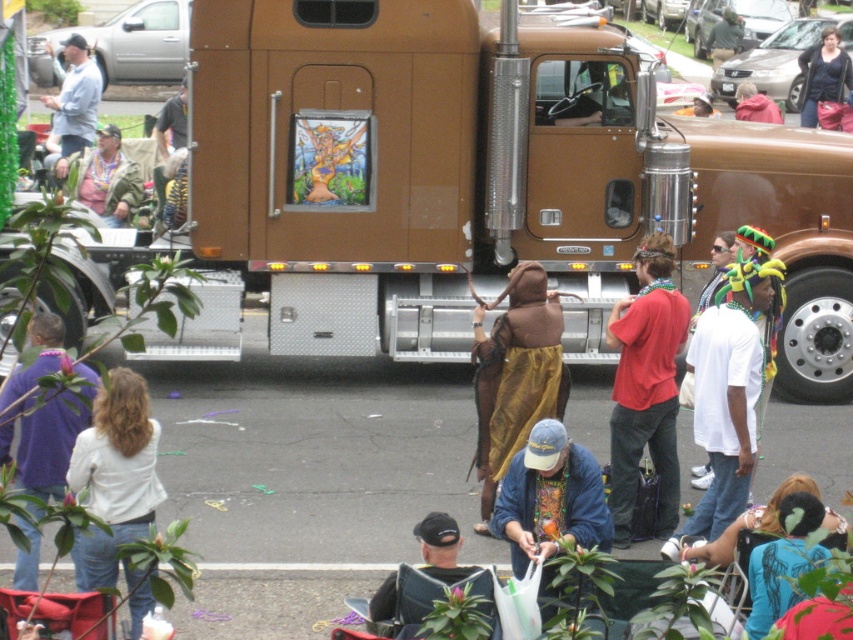
Looking at this image, is white fabric jacket at lower left to the right of brushed metal jacket at upper left from the viewer's perspective?

Yes, white fabric jacket at lower left is to the right of brushed metal jacket at upper left.

From the picture: Who is taller, white fabric jacket at lower left or brushed metal jacket at upper left?

Standing taller between the two is white fabric jacket at lower left.

Locate an element on the screen. This screenshot has height=640, width=853. white fabric jacket at lower left is located at coordinates (115, 476).

The image size is (853, 640). Describe the element at coordinates (515, 374) in the screenshot. I see `brown fabric at center` at that location.

Can you confirm if brown fabric at center is thinner than dark blue baseball cap at center?

In fact, brown fabric at center might be wider than dark blue baseball cap at center.

Does point (519, 444) lie behind point (439, 522)?

Yes, it is.

The image size is (853, 640). Find the location of `brown fabric at center`. brown fabric at center is located at coordinates (515, 374).

Is blue t-shirt at lower right closer to camera compared to brushed metal jacket at upper left?

That is True.

Between blue t-shirt at lower right and brushed metal jacket at upper left, which one has less height?

blue t-shirt at lower right

Identify the location of blue t-shirt at lower right. The image size is (853, 640). (782, 563).